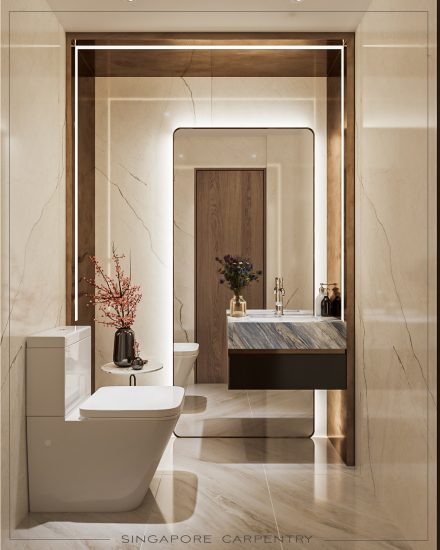
Where is `reflection of marble floor`? reflection of marble floor is located at coordinates (229, 401).